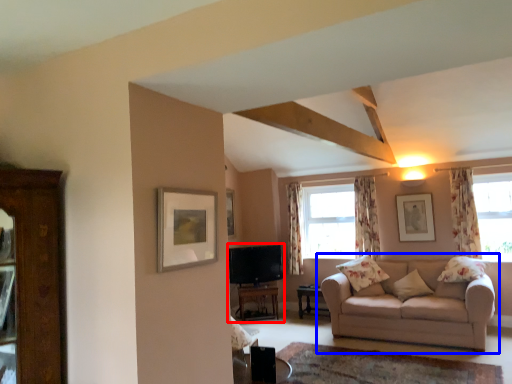
Question: Which of the following is the farthest to the observer, entertainment center (highlighted by a red box) or studio couch (highlighted by a blue box)?

Choices:
 (A) entertainment center
 (B) studio couch

Answer: (A)